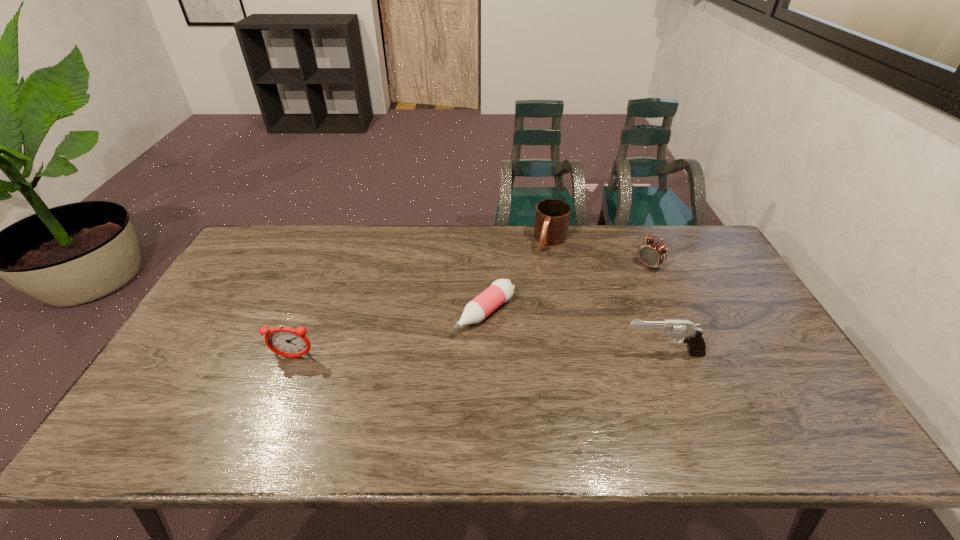
Find the location of `the nearer alarm clock`. the nearer alarm clock is located at coordinates (284, 341).

You are a GUI agent. You are given a task and a screenshot of the screen. Output one action in this format:
    pyautogui.click(x=<x>, y=<y>)
    Task: Click on the left alarm clock
    This screenshot has width=960, height=540.
    Given the screenshot: What is the action you would take?
    pyautogui.click(x=284, y=341)

Locate an element on the screen. This screenshot has height=540, width=960. gun is located at coordinates (691, 334).

The image size is (960, 540). Identify the location of the shortest object. (501, 290).

At what (x,y) coordinates should I click in order to perform the action: click on the fourth object from right to left. Please return your answer as a coordinate pair (x, y). Looking at the image, I should click on (501, 290).

Find the location of a particular element. mug is located at coordinates point(552,216).

You are a GUI agent. You are given a task and a screenshot of the screen. Output one action in this format:
    pyautogui.click(x=<x>, y=<y>)
    Task: Click on the third object from left to right
    
    Given the screenshot: What is the action you would take?
    pyautogui.click(x=552, y=216)

At what (x,y) coordinates should I click in order to perform the action: click on the farther alarm clock. Please return your answer as a coordinate pair (x, y). Looking at the image, I should click on (652, 253).

Where is `the second farthest object`? The height and width of the screenshot is (540, 960). the second farthest object is located at coordinates (652, 253).

Image resolution: width=960 pixels, height=540 pixels. I want to click on vacant space located 0.150m on the front-facing side of the nearer alarm clock, so click(272, 412).